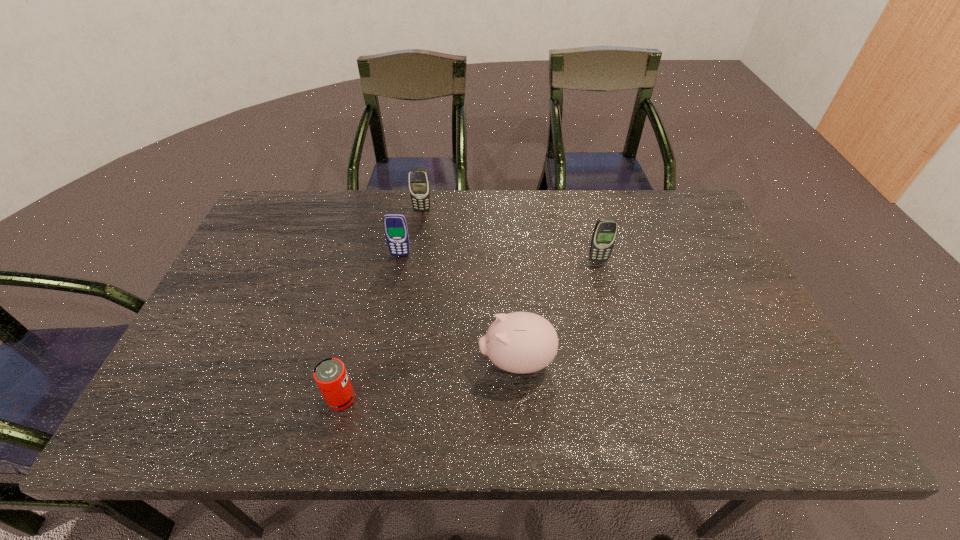
The height and width of the screenshot is (540, 960). In order to click on the farthest object in this screenshot , I will do `click(419, 184)`.

Find the location of a particular element. The height and width of the screenshot is (540, 960). the rightmost cellular telephone is located at coordinates (605, 231).

What are the coordinates of `the third nearest object` in the screenshot? It's located at (605, 231).

The height and width of the screenshot is (540, 960). I want to click on the second nearest cellular telephone, so click(x=395, y=225).

This screenshot has height=540, width=960. I want to click on the second object from right to left, so click(x=519, y=342).

Where is `the leftmost object`? This screenshot has height=540, width=960. the leftmost object is located at coordinates (330, 374).

What are the coordinates of `the shortest object` in the screenshot? It's located at (330, 374).

Find the location of `free region located on the front face of the farthest object`. free region located on the front face of the farthest object is located at coordinates (420, 226).

The height and width of the screenshot is (540, 960). In order to click on blank area located 0.120m on the screen of the rightmost cellular telephone in this screenshot , I will do `click(607, 293)`.

Where is `free location located 0.350m on the front-facing side of the second nearest cellular telephone`? Image resolution: width=960 pixels, height=540 pixels. free location located 0.350m on the front-facing side of the second nearest cellular telephone is located at coordinates (381, 359).